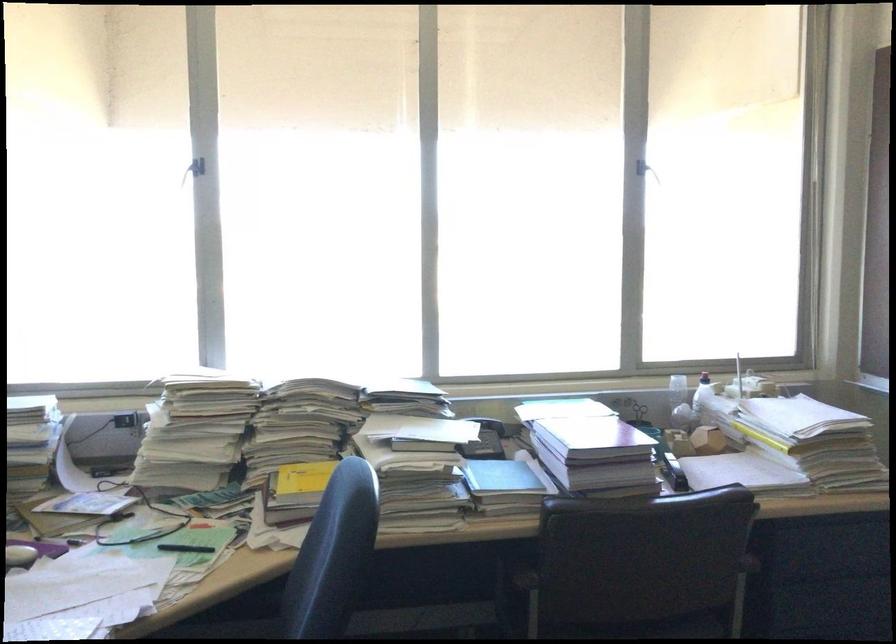
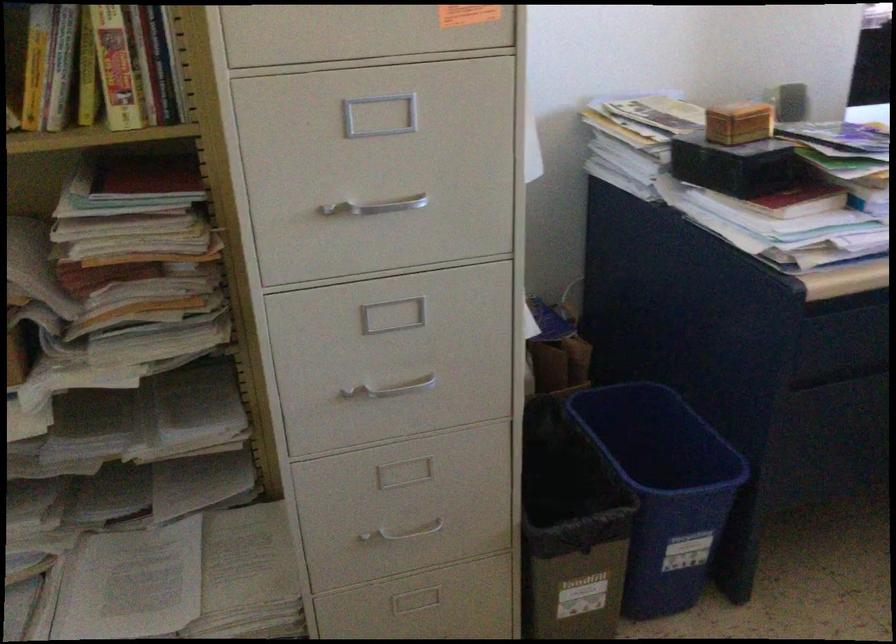
First-person continuous shooting, in which direction is the camera rotating?

The rotation direction of the camera is left-down.